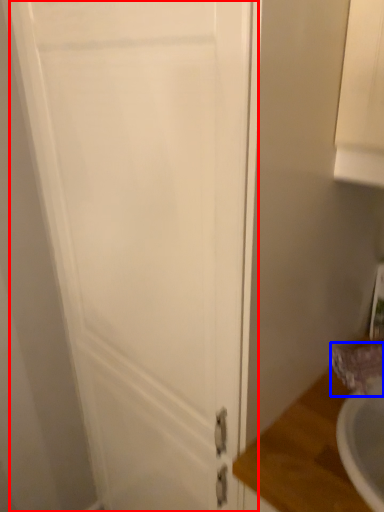
Question: Which object is further to the camera taking this photo, door (highlighted by a red box) or faucet (highlighted by a blue box)?

Choices:
 (A) door
 (B) faucet

Answer: (B)